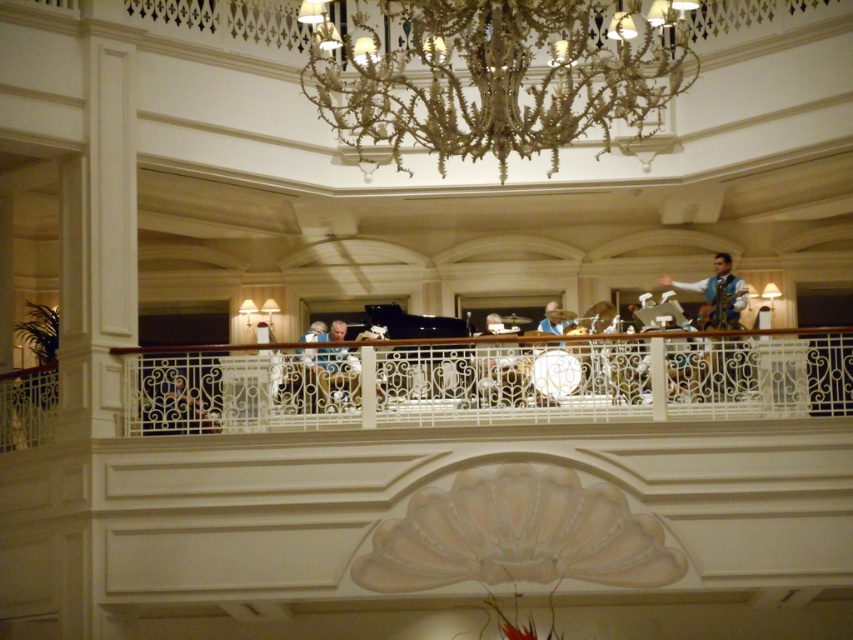
Question: Among these objects, which one is nearest to the camera?

Choices:
 (A) light blue fabric at upper right
 (B) light blue fabric at center
 (C) white wrought iron railing at upper center
 (D) gold metallic chandelier at upper center

Answer: (D)

Question: Which point is closer to the camera taking this photo?

Choices:
 (A) (355, 22)
 (B) (316, 374)
 (C) (518, 371)

Answer: (A)

Question: Can you confirm if white wrought iron railing at upper center is smaller than gold metallic chandelier at upper center?

Choices:
 (A) yes
 (B) no

Answer: (A)

Question: In this image, where is gold metallic chandelier at upper center located relative to light blue fabric at upper right?

Choices:
 (A) left
 (B) right

Answer: (A)

Question: Which object is closer to the camera taking this photo?

Choices:
 (A) gold metallic chandelier at upper center
 (B) light brown wooden chair at center

Answer: (A)

Question: From the image, what is the correct spatial relationship of white wrought iron railing at upper center in relation to light blue fabric at upper right?

Choices:
 (A) left
 (B) right

Answer: (A)